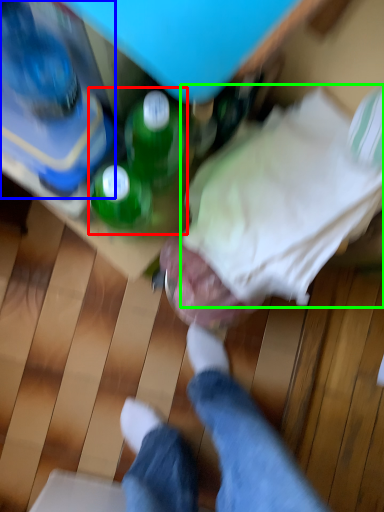
Question: Considering the real-world distances, which object is farthest from beverage (highlighted by a red box)? bottle (highlighted by a blue box) or clothing (highlighted by a green box)?

Choices:
 (A) bottle
 (B) clothing

Answer: (B)